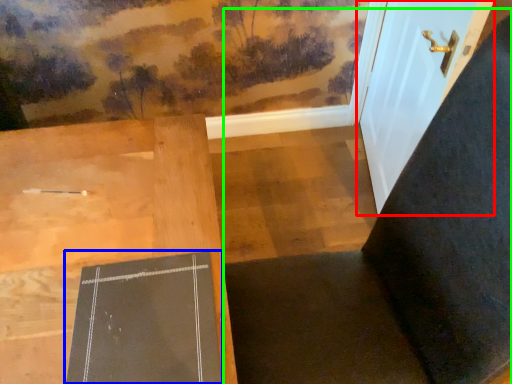
Question: Which is farther away from door (highlighted by a red box)? bulletin board (highlighted by a blue box) or chair (highlighted by a green box)?

Choices:
 (A) bulletin board
 (B) chair

Answer: (A)